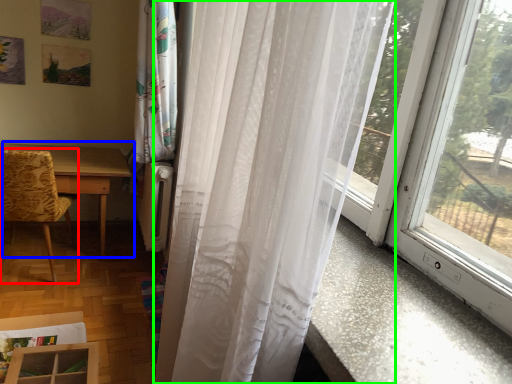
Question: Which object is positioned closest to chair (highlighted by a red box)? Select from table (highlighted by a blue box) and curtain (highlighted by a green box).

Choices:
 (A) table
 (B) curtain

Answer: (A)